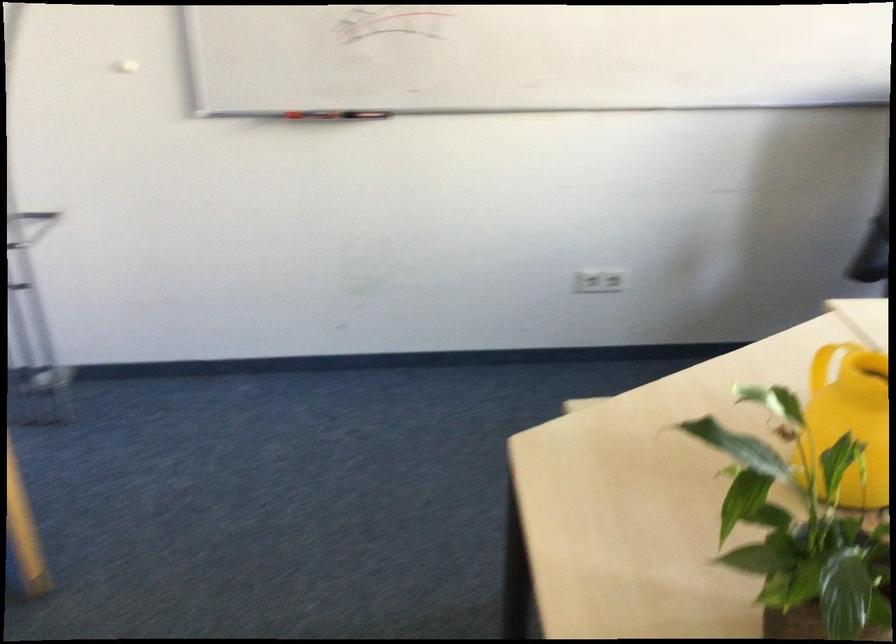
At what (x,y) coordinates should I click in order to perform the action: click on yellow can handle. Please return your answer as a coordinate pair (x, y). Looking at the image, I should click on (849, 420).